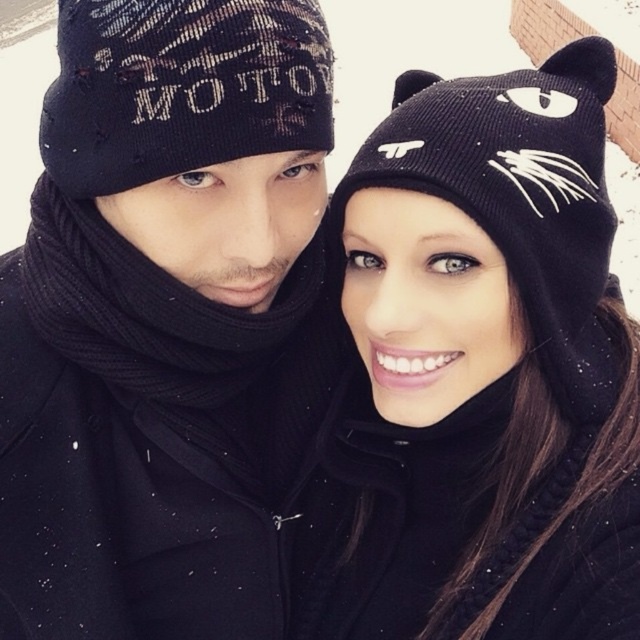
You are planning to buy a beanie for your friend who has a small head. You see two beanies in the image, the black knit beanie with cat ears at upper right and the black knitted beanie at left. Which one is more suitable for a small head?

The black knitted beanie at left is more suitable for a small head because it has a smaller width compared to the black knit beanie with cat ears at upper right.

You are trying to locate the matte black beanie at center in the snowy scene. According to the coordinates provided, where exactly would you look to find it?

The matte black beanie at center is located at point coordinates (164, 321).

You are a photographer trying to capture both the black knit beanie with cat ears at upper right and the black knitted beanie at left in a single shot. Given that the camera can only focus on objects within a 1.5 meter height range, will both be within the focus range?

The black knit beanie with cat ears at upper right is much taller than the black knitted beanie at left. Since the camera can focus on objects within a 1.5 meter height range, both will be within the focus range as long as their height difference is less than 1.5 meters. However, the exact heights aren